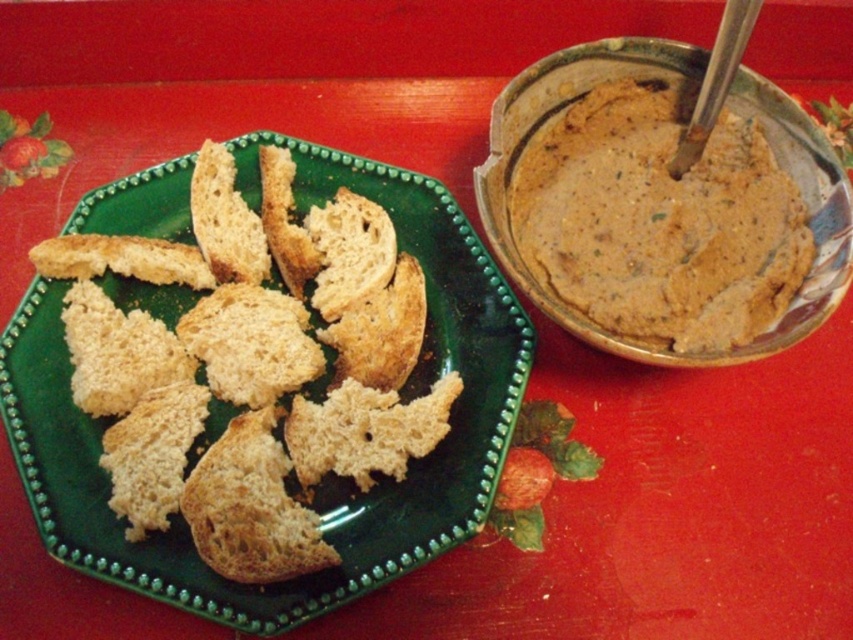
Question: Can you confirm if green matte plate at center is wider than smooth brown paste at upper right?

Choices:
 (A) no
 (B) yes

Answer: (B)

Question: Can you confirm if green matte plate at center is smaller than golden brown crumbly bread at center?

Choices:
 (A) no
 (B) yes

Answer: (A)

Question: Which object is closer to the camera taking this photo?

Choices:
 (A) green matte plate at center
 (B) golden brown crumbly bread at center
 (C) smooth brown paste at upper right

Answer: (A)

Question: Is green matte plate at center wider than golden brown crumbly bread at center?

Choices:
 (A) no
 (B) yes

Answer: (B)

Question: Which object is the closest to the green matte plate at center?

Choices:
 (A) smooth brown paste at upper right
 (B) golden brown crumbly bread at center

Answer: (B)

Question: Which point appears farthest from the camera in this image?

Choices:
 (A) (253, 262)
 (B) (730, 141)

Answer: (A)